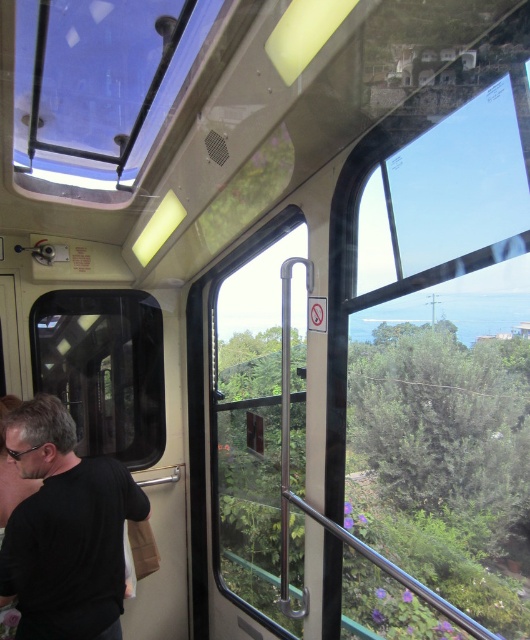
Question: Considering the real-world distances, which object is farthest from the black matte shirt at left?

Choices:
 (A) transparent glass window at upper right
 (B) clear glass window at center

Answer: (A)

Question: In this image, where is transparent glass window at center located relative to matte black hair at left?

Choices:
 (A) right
 (B) left

Answer: (A)

Question: Which object is the closest to the clear glass window at center?

Choices:
 (A) transparent glass window at upper right
 (B) transparent plastic window at upper center
 (C) black matte shirt at left

Answer: (C)

Question: Is transparent glass window at upper right bigger than black matte shirt at left?

Choices:
 (A) no
 (B) yes

Answer: (B)

Question: Which point is closer to the camera?

Choices:
 (A) clear glass window at center
 (B) transparent glass window at center
 (C) black matte shirt at left
 (D) transparent plastic window at upper center

Answer: (D)

Question: Where is clear glass window at center located in relation to transparent glass window at center in the image?

Choices:
 (A) left
 (B) right

Answer: (B)